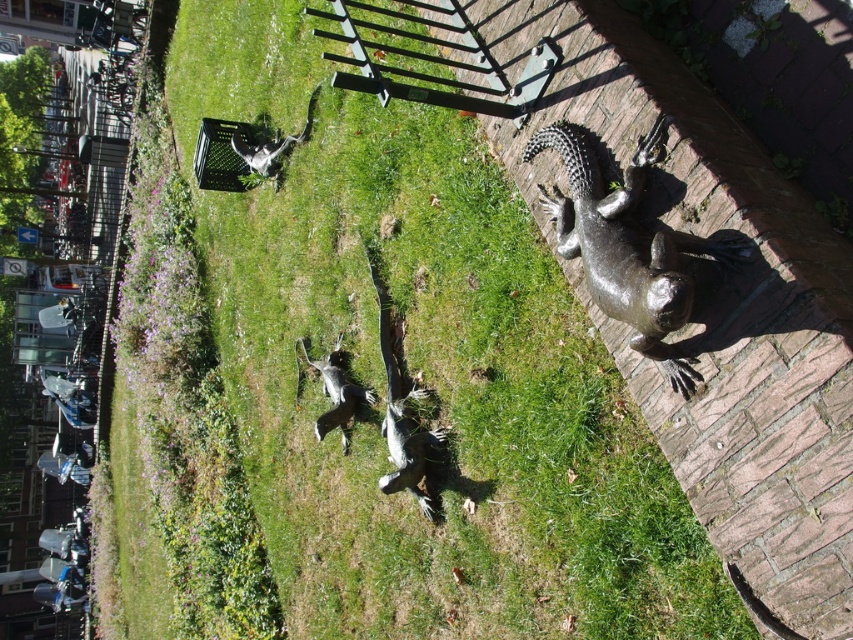
Who is shorter, shiny bronze iguana at right or shiny silver statue at upper left?

shiny silver statue at upper left is shorter.

The image size is (853, 640). Describe the element at coordinates (625, 244) in the screenshot. I see `shiny bronze iguana at right` at that location.

Is point (589, 243) positioned in front of point (265, 141)?

Yes, it is in front of point (265, 141).

This screenshot has width=853, height=640. What are the coordinates of `shiny bronze iguana at right` in the screenshot? It's located at (625, 244).

Can you confirm if shiny bronze iguana at right is positioned to the right of shiny silver statue at center?

Indeed, shiny bronze iguana at right is positioned on the right side of shiny silver statue at center.

Which is behind, point (579, 150) or point (340, 355)?

The point (340, 355) is behind.

Who is more forward, (549, 140) or (335, 412)?

Point (549, 140) is in front.

Where is `shiny bronze iguana at right`? Image resolution: width=853 pixels, height=640 pixels. shiny bronze iguana at right is located at coordinates (625, 244).

Does point (334, 376) lie behind point (231, 147)?

No, (334, 376) is closer to viewer.

Is point (350, 401) positioned in front of point (283, 154)?

Yes, point (350, 401) is closer to viewer.

At what (x,y) coordinates should I click in order to perform the action: click on shiny silver statue at center. Please return your answer as a coordinate pair (x, y). Looking at the image, I should click on (337, 392).